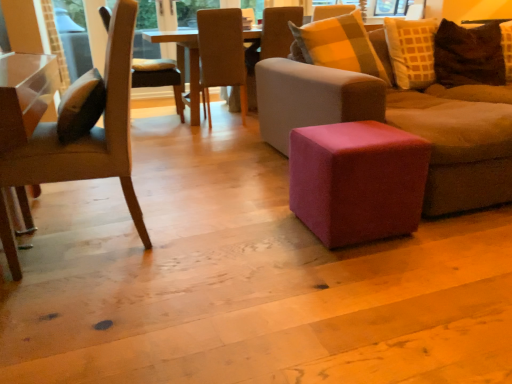
What do you see at coordinates (90, 132) in the screenshot? I see `matte brown chair at left, the first chair when ordered from front to back` at bounding box center [90, 132].

What is the approximate height of velvet brown couch at center?

velvet brown couch at center is 31.77 inches in height.

What do you see at coordinates (401, 125) in the screenshot? I see `velvet brown couch at center` at bounding box center [401, 125].

The height and width of the screenshot is (384, 512). What do you see at coordinates (270, 43) in the screenshot? I see `light beige fabric chair at upper center, the 3th chair when ordered from front to back` at bounding box center [270, 43].

What is the approximate height of pink fabric stool at center?

It is 17.55 inches.

Image resolution: width=512 pixels, height=384 pixels. In order to click on wooden chair at center, which is the fourth chair from front to back in this screenshot , I will do `click(159, 78)`.

Identify the location of brown textured pillow at upper right. This screenshot has width=512, height=384. (468, 55).

The width and height of the screenshot is (512, 384). In order to click on matte brown chair at left, the first chair when ordered from front to back in this screenshot , I will do `click(90, 132)`.

Would you say brown textured pillow at upper right is to the left or to the right of beige fabric chair at center, acting as the 3th chair starting from the back, in the picture?

In the image, brown textured pillow at upper right appears on the right side of beige fabric chair at center, acting as the 3th chair starting from the back.

From the image's perspective, is brown textured pillow at upper right above or below beige fabric chair at center, acting as the 3th chair starting from the back?

brown textured pillow at upper right is below beige fabric chair at center, acting as the 3th chair starting from the back.

Is brown textured pillow at upper right bigger than beige fabric chair at center, acting as the 2th chair starting from the front?

Incorrect, brown textured pillow at upper right is not larger than beige fabric chair at center, acting as the 2th chair starting from the front.

Which object is further away from the camera, brown textured pillow at upper right or beige fabric chair at center, acting as the 3th chair starting from the back?

beige fabric chair at center, acting as the 3th chair starting from the back, is more distant.

Considering the points (467, 35) and (232, 107), which point is behind, point (467, 35) or point (232, 107)?

The point (232, 107) is more distant.

Considering the relative sizes of brown textured pillow at upper right and light beige fabric chair at upper center, the 3th chair when ordered from front to back, in the image provided, is brown textured pillow at upper right taller than light beige fabric chair at upper center, the 3th chair when ordered from front to back,?

No.

From the image's perspective, is brown textured pillow at upper right under light beige fabric chair at upper center, positioned as the 2th chair in back-to-front order?

Yes, from the image's perspective, brown textured pillow at upper right is beneath light beige fabric chair at upper center, positioned as the 2th chair in back-to-front order.

Is brown textured pillow at upper right oriented away from light beige fabric chair at upper center, positioned as the 2th chair in back-to-front order?

brown textured pillow at upper right is not turned away from light beige fabric chair at upper center, positioned as the 2th chair in back-to-front order.

Is light beige fabric chair at upper center, positioned as the 2th chair in back-to-front order, far away from wooden chair at center, the first chair when ordered from back to front?

Yes, light beige fabric chair at upper center, positioned as the 2th chair in back-to-front order, and wooden chair at center, the first chair when ordered from back to front, are located far from each other.

Could wooden chair at center, which is the fourth chair from front to back, be considered to be inside light beige fabric chair at upper center, positioned as the 2th chair in back-to-front order?

No, wooden chair at center, which is the fourth chair from front to back, is not a part of light beige fabric chair at upper center, positioned as the 2th chair in back-to-front order.

From the image's perspective, relative to wooden chair at center, the first chair when ordered from back to front, is light beige fabric chair at upper center, positioned as the 2th chair in back-to-front order, above or below?

Clearly, from the image's perspective, light beige fabric chair at upper center, positioned as the 2th chair in back-to-front order, is above wooden chair at center, the first chair when ordered from back to front.

Which object is further away from the camera, light beige fabric chair at upper center, the 3th chair when ordered from front to back, or wooden chair at center, the first chair when ordered from back to front?

Positioned behind is wooden chair at center, the first chair when ordered from back to front.

What are the coordinates of `the 4th chair directly above the pink fabric stool at center (from a real-world perspective)` in the screenshot? It's located at pos(270,43).

Which object is thinner, light beige fabric chair at upper center, the 3th chair when ordered from front to back, or pink fabric stool at center?

pink fabric stool at center is thinner.

Considering the positions of points (286, 32) and (313, 160), is point (286, 32) farther from camera compared to point (313, 160)?

Yes, it is.

Considering the positions of objects light beige fabric chair at upper center, the 3th chair when ordered from front to back, and pink fabric stool at center in the image provided, who is in front, light beige fabric chair at upper center, the 3th chair when ordered from front to back, or pink fabric stool at center?

Positioned in front is pink fabric stool at center.

Could you measure the distance between wooden chair at center, the first chair when ordered from back to front, and light beige fabric chair at upper center, the 3th chair when ordered from front to back?

wooden chair at center, the first chair when ordered from back to front, is 3.29 feet away from light beige fabric chair at upper center, the 3th chair when ordered from front to back.

From the image's perspective, who appears lower, wooden chair at center, which is the fourth chair from front to back, or light beige fabric chair at upper center, positioned as the 2th chair in back-to-front order?

wooden chair at center, which is the fourth chair from front to back, appears lower in the image.

Considering the sizes of objects wooden chair at center, which is the fourth chair from front to back, and light beige fabric chair at upper center, the 3th chair when ordered from front to back, in the image provided, who is wider, wooden chair at center, which is the fourth chair from front to back, or light beige fabric chair at upper center, the 3th chair when ordered from front to back,?

wooden chair at center, which is the fourth chair from front to back.

Is wooden chair at center, the first chair when ordered from back to front, completely or partially outside of light beige fabric chair at upper center, the 3th chair when ordered from front to back?

wooden chair at center, the first chair when ordered from back to front, lies outside light beige fabric chair at upper center, the 3th chair when ordered from front to back,'s area.

In the scene shown: Considering the sizes of objects brown textured pillow at upper right and wooden chair at center, which is the fourth chair from front to back, in the image provided, who is shorter, brown textured pillow at upper right or wooden chair at center, which is the fourth chair from front to back,?

With less height is brown textured pillow at upper right.

Is brown textured pillow at upper right directly adjacent to wooden chair at center, the first chair when ordered from back to front?

No, brown textured pillow at upper right is not beside wooden chair at center, the first chair when ordered from back to front.

Does brown textured pillow at upper right have a greater width compared to wooden chair at center, which is the fourth chair from front to back?

No.

From the image's perspective, does brown textured pillow at upper right appear higher than wooden chair at center, the first chair when ordered from back to front?

No, from the image's perspective, brown textured pillow at upper right is not above wooden chair at center, the first chair when ordered from back to front.

In terms of height, does brown textured pillow at upper right look taller or shorter compared to pink fabric stool at center?

Clearly, brown textured pillow at upper right is taller compared to pink fabric stool at center.

Is brown textured pillow at upper right turned away from pink fabric stool at center?

No, brown textured pillow at upper right is not facing away from pink fabric stool at center.

Between brown textured pillow at upper right and pink fabric stool at center, which one has larger width?

pink fabric stool at center is wider.

Is brown textured pillow at upper right spatially inside pink fabric stool at center, or outside of it?

brown textured pillow at upper right lies outside pink fabric stool at center.

From the brown textured pillow at upper right, count 1st chairs backward and point to it. Please provide its 2D coordinates.

[(221, 54)]

From the brown textured pillow at upper right, count the 1st chair to the left and point to it. Please provide its 2D coordinates.

[(270, 43)]

Looking at the image, which one is located closer to matte brown chair at left, the first chair when ordered from front to back, wooden chair at center, the first chair when ordered from back to front, or pink fabric stool at center?

pink fabric stool at center lies closer to matte brown chair at left, the first chair when ordered from front to back, than the other object.

Based on their spatial positions, is light beige fabric chair at upper center, positioned as the 2th chair in back-to-front order, or matte brown chair at left, which is counted as the 4th chair, starting from the back, further from pink fabric stool at center?

light beige fabric chair at upper center, positioned as the 2th chair in back-to-front order, is further to pink fabric stool at center.

Based on their spatial positions, is velvet brown couch at center or pink fabric stool at center further from light beige fabric chair at upper center, the 3th chair when ordered from front to back?

pink fabric stool at center is further to light beige fabric chair at upper center, the 3th chair when ordered from front to back.

Considering their positions, is brown textured pillow at upper right positioned closer to wooden chair at center, the first chair when ordered from back to front, than light beige fabric chair at upper center, the 3th chair when ordered from front to back?

light beige fabric chair at upper center, the 3th chair when ordered from front to back.

Considering their positions, is beige fabric chair at center, acting as the 2th chair starting from the front, positioned further to wooden chair at center, which is the fourth chair from front to back, than velvet brown couch at center?

velvet brown couch at center lies further to wooden chair at center, which is the fourth chair from front to back, than the other object.

Considering their positions, is beige fabric chair at center, acting as the 2th chair starting from the front, positioned closer to light beige fabric chair at upper center, the 3th chair when ordered from front to back, than pink fabric stool at center?

The object closer to light beige fabric chair at upper center, the 3th chair when ordered from front to back, is beige fabric chair at center, acting as the 2th chair starting from the front.

Based on their spatial positions, is pink fabric stool at center or matte brown chair at left, which is counted as the 4th chair, starting from the back, further from beige fabric chair at center, acting as the 2th chair starting from the front?

pink fabric stool at center is further to beige fabric chair at center, acting as the 2th chair starting from the front.

Based on the photo, looking at the image, which one is located further to pink fabric stool at center, light beige fabric chair at upper center, positioned as the 2th chair in back-to-front order, or brown textured pillow at upper right?

light beige fabric chair at upper center, positioned as the 2th chair in back-to-front order, lies further to pink fabric stool at center than the other object.

Image resolution: width=512 pixels, height=384 pixels. In order to click on stool between matte brown chair at left, the first chair when ordered from front to back, and wooden chair at center, the first chair when ordered from back to front, in the front-back direction in this screenshot , I will do `click(357, 181)`.

Where is `stool between matte brown chair at left, the first chair when ordered from front to back, and light beige fabric chair at upper center, positioned as the 2th chair in back-to-front order, from front to back`? This screenshot has height=384, width=512. stool between matte brown chair at left, the first chair when ordered from front to back, and light beige fabric chair at upper center, positioned as the 2th chair in back-to-front order, from front to back is located at coordinates (357, 181).

Find the location of a particular element. The width and height of the screenshot is (512, 384). stool located between wooden chair at center, the first chair when ordered from back to front, and brown textured pillow at upper right in the left-right direction is located at coordinates (357, 181).

Identify the location of pillow between pink fabric stool at center and light beige fabric chair at upper center, the 3th chair when ordered from front to back, in the front-back direction. The width and height of the screenshot is (512, 384). (468, 55).